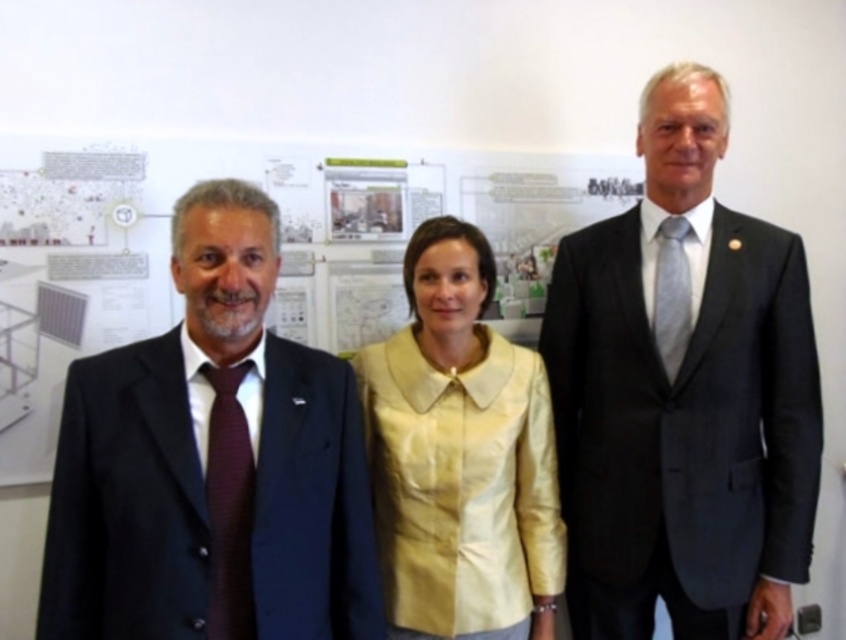
Who is positioned more to the right, dark gray suit at center or dark blue suit at center?

dark gray suit at center is more to the right.

Can you confirm if dark gray suit at center is bigger than dark blue suit at center?

Indeed, dark gray suit at center has a larger size compared to dark blue suit at center.

You are a GUI agent. You are given a task and a screenshot of the screen. Output one action in this format:
    pyautogui.click(x=<x>, y=<y>)
    Task: Click on the dark gray suit at center
    The width and height of the screenshot is (846, 640).
    Given the screenshot: What is the action you would take?
    pyautogui.click(x=684, y=397)

Who is higher up, dark blue suit at center or maroon textured tie at left?

dark blue suit at center is higher up.

Who is more distant from viewer, (246, 403) or (229, 632)?

Positioned behind is point (246, 403).

Who is more distant from viewer, (x=125, y=426) or (x=250, y=573)?

The point (x=125, y=426) is behind.

What are the coordinates of `dark blue suit at center` in the screenshot? It's located at (212, 461).

Locate an element on the screen. matte yellow blouse at center is located at coordinates (460, 456).

Is matte yellow blouse at center closer to the viewer compared to light gray silk tie at right?

That is True.

What do you see at coordinates (460, 456) in the screenshot? This screenshot has width=846, height=640. I see `matte yellow blouse at center` at bounding box center [460, 456].

Image resolution: width=846 pixels, height=640 pixels. Identify the location of matte yellow blouse at center. (460, 456).